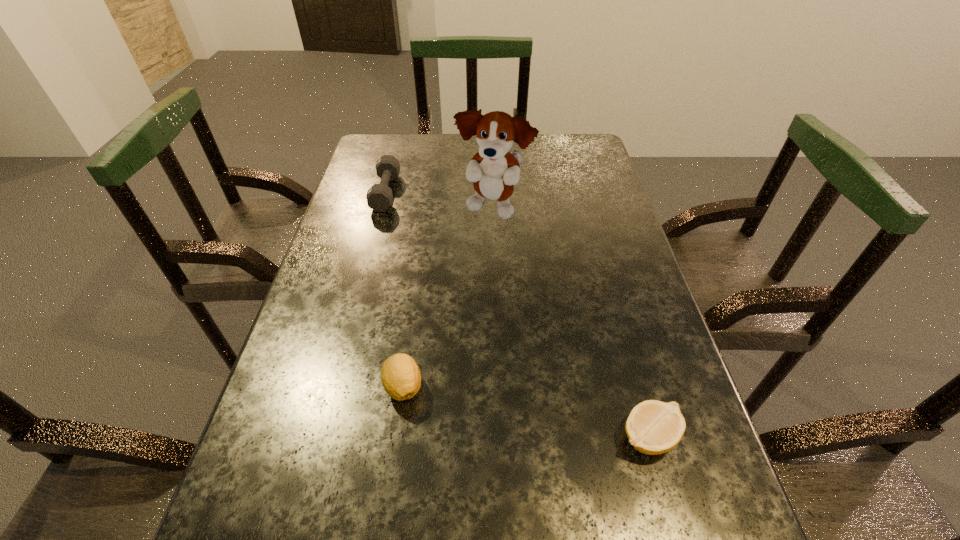
You are a GUI agent. You are given a task and a screenshot of the screen. Output one action in this format:
    pyautogui.click(x=<x>, y=<y>)
    Task: Click on the free space that satisfies the following two spatial constraints: 1. on the front side of the rightmost object; 2. on the left side of the leftmost object
    
    Given the screenshot: What is the action you would take?
    pyautogui.click(x=322, y=436)